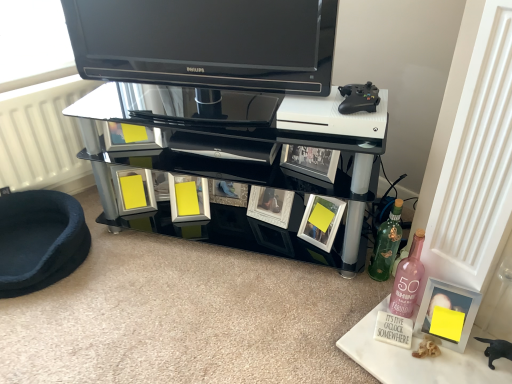
Image resolution: width=512 pixels, height=384 pixels. I want to click on vacant area that lies in front of matte silver picture frame at lower right, which is the 2th picture frame from back to front, so click(x=456, y=370).